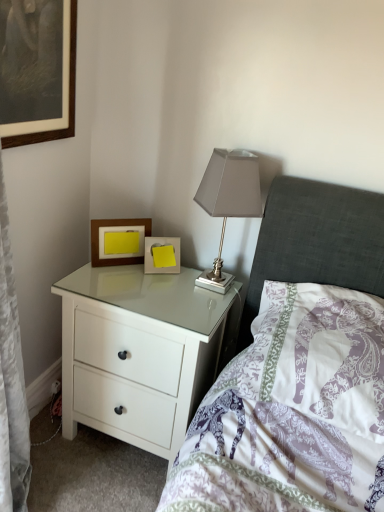
Find the location of a particular element. vacant area that lies in front of wooden picture frame at upper left, which is the second picture frame from bottom to top is located at coordinates (110, 282).